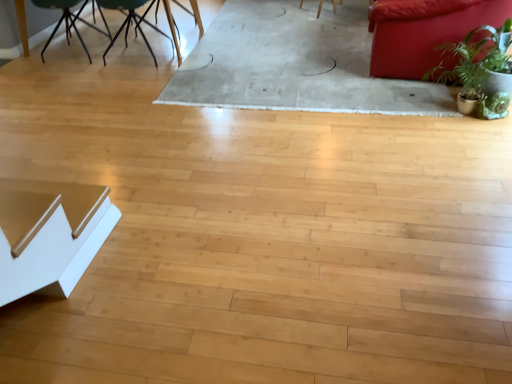
Identify the location of free space to the left of green leafy plant at right. (395, 110).